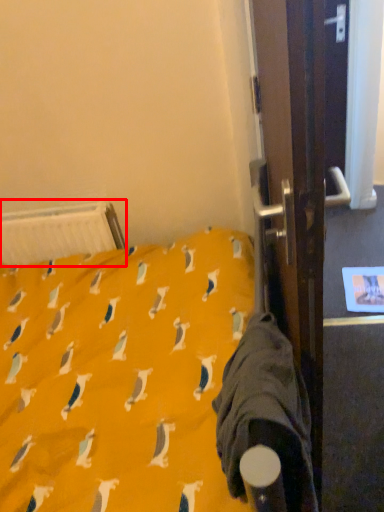
Question: Observing the image, what is the correct spatial positioning of radiator (annotated by the red box) in reference to sleeping bag?

Choices:
 (A) left
 (B) right

Answer: (A)